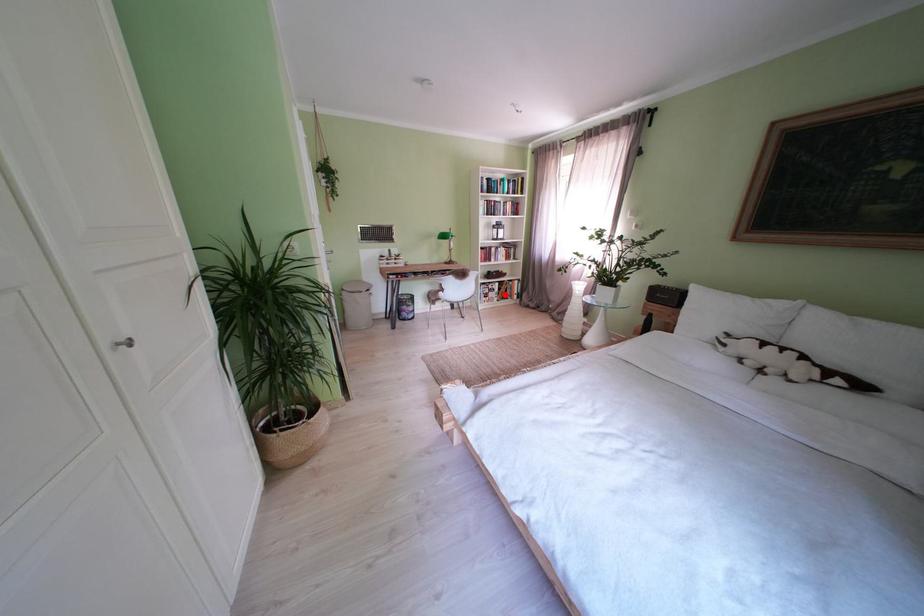
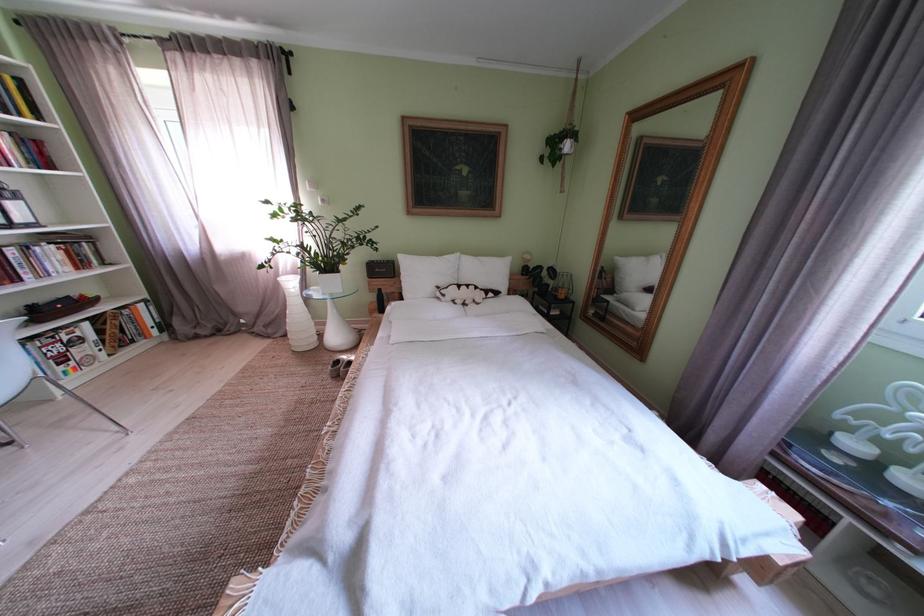
Where in the second image is the point corresponding to the highlighted location from the first image?

(92, 344)